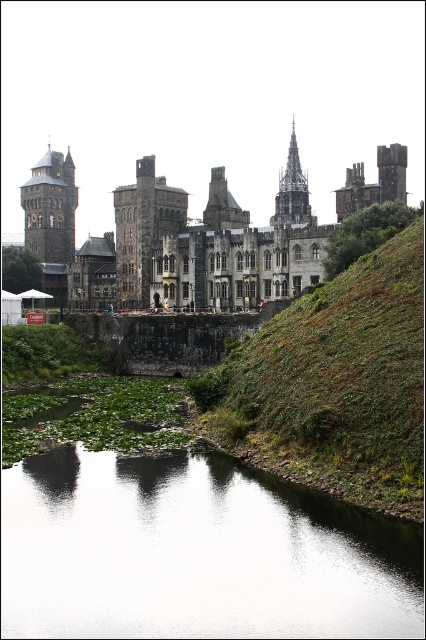
Does stone castle at center have a greater width compared to brown stone tower at left?

Indeed, stone castle at center has a greater width compared to brown stone tower at left.

Does stone castle at center appear on the right side of brown stone tower at left?

Indeed, stone castle at center is positioned on the right side of brown stone tower at left.

At what (x,y) coordinates should I click in order to perform the action: click on stone castle at center. Please return your answer as a coordinate pair (x, y). Looking at the image, I should click on (192, 237).

Find the location of `stone castle at center`. stone castle at center is located at coordinates (192, 237).

Is green grassy hillside at center-right thinner than dark gray stone tower at center?

In fact, green grassy hillside at center-right might be wider than dark gray stone tower at center.

Which is above, green grassy hillside at center-right or dark gray stone tower at center?

Positioned higher is dark gray stone tower at center.

Measure the distance between green grassy hillside at center-right and camera.

48.41 meters

Locate an element on the screen. The image size is (426, 640). green grassy hillside at center-right is located at coordinates (333, 385).

Who is more forward, (342,328) or (304,182)?

Point (342,328) is in front.

The image size is (426, 640). Identify the location of green grassy hillside at center-right. (333, 385).